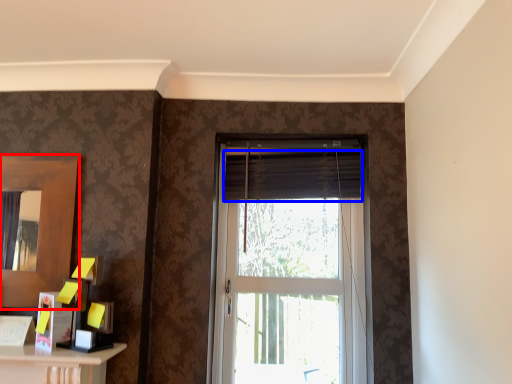
Question: Which object appears farthest to the camera in this image, mirror (highlighted by a red box) or curtain (highlighted by a blue box)?

Choices:
 (A) mirror
 (B) curtain

Answer: (B)